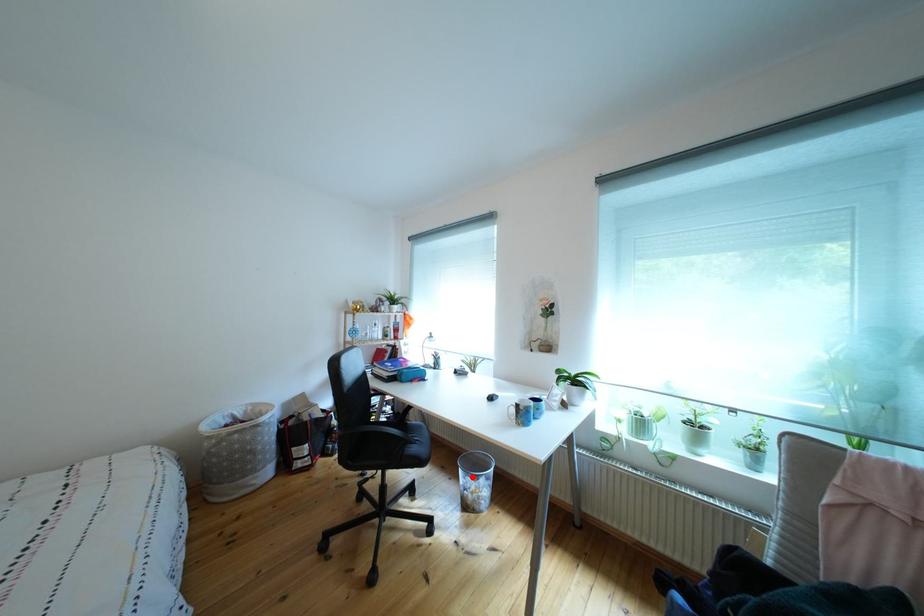
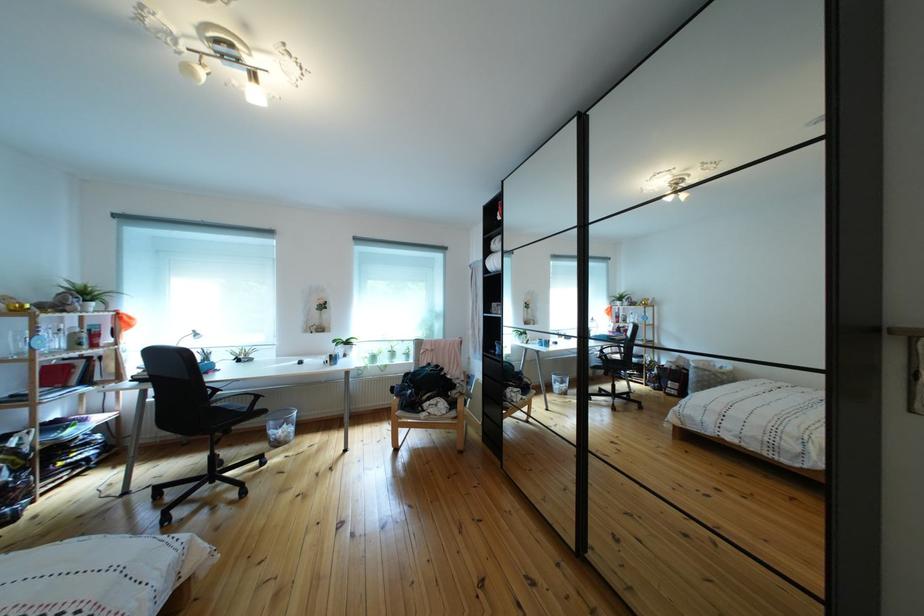
Question: A red point is marked in image1. In image2, is the corresponding 3D point closer to the camera or farther? Reply with the corresponding letter.

Choices:
 (A) The corresponding 3D point is closer.
 (B) The corresponding 3D point is farther.

Answer: (A)